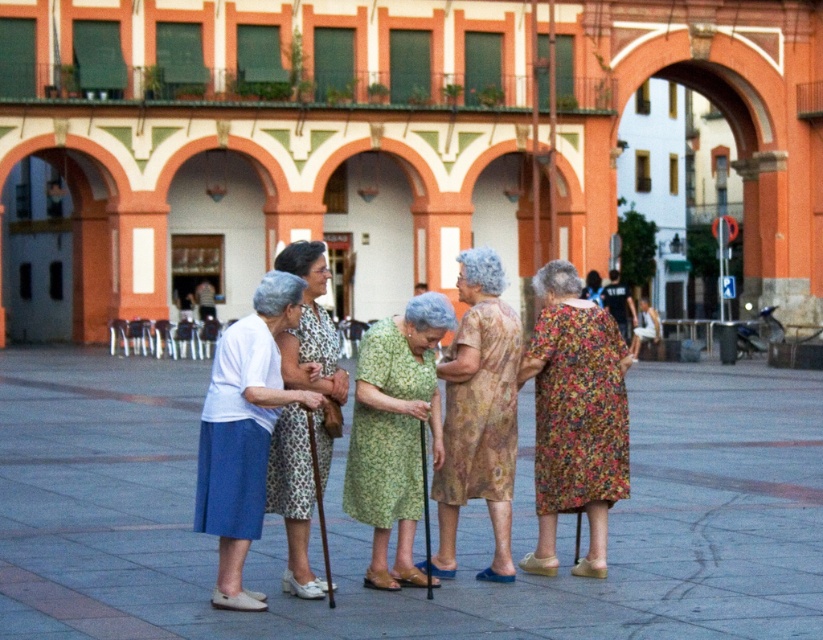
Question: Is green floral dress at center below floral dress at center?

Choices:
 (A) yes
 (B) no

Answer: (B)

Question: Which of these objects is positioned farthest from the printed fabric dress at center?

Choices:
 (A) floral dress at center
 (B) white cotton dress at center

Answer: (A)

Question: Does floral print dress at center appear over white cotton dress at center?

Choices:
 (A) yes
 (B) no

Answer: (A)

Question: Which point is farther to the camera?

Choices:
 (A) (291, 378)
 (B) (467, 342)
 (C) (415, 454)

Answer: (B)

Question: Which of these objects is positioned farthest from the white cotton dress at center?

Choices:
 (A) floral dress at center
 (B) green floral dress at center
 (C) printed fabric dress at center

Answer: (A)

Question: Does floral print dress at center have a lesser width compared to green floral dress at center?

Choices:
 (A) yes
 (B) no

Answer: (A)